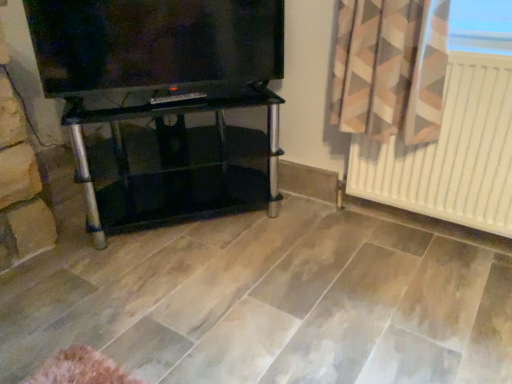
Question: Is black glass tv stand at center wider or thinner than white matte radiator at right?

Choices:
 (A) thin
 (B) wide

Answer: (B)

Question: Is black glass tv stand at center inside the boundaries of white matte radiator at right, or outside?

Choices:
 (A) inside
 (B) outside

Answer: (B)

Question: Estimate the real-world distances between objects in this image. Which object is closer to the matte black tv at upper left?

Choices:
 (A) white matte radiator at right
 (B) black glass tv stand at center

Answer: (B)

Question: Which is farther from the matte black tv at upper left?

Choices:
 (A) black glass tv stand at center
 (B) white matte radiator at right

Answer: (B)